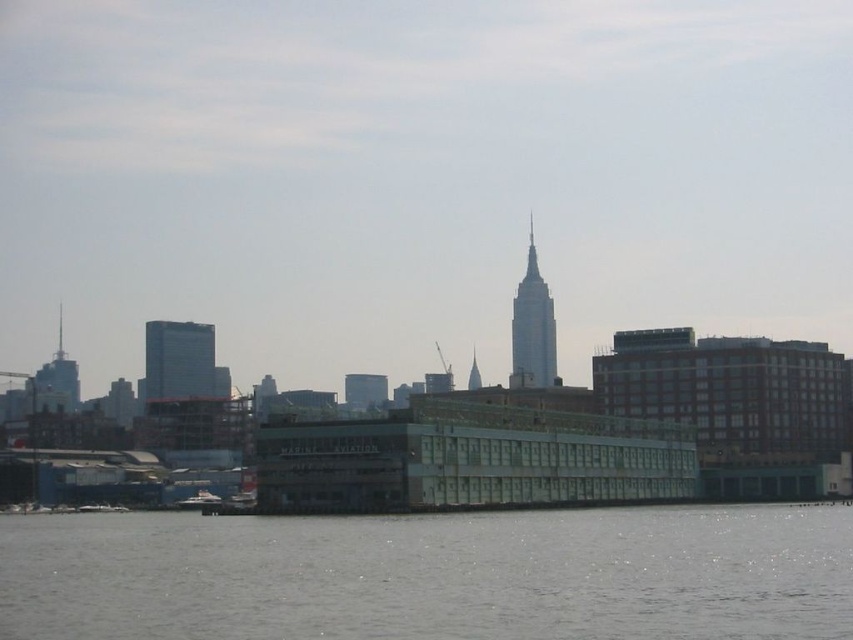
Who is positioned more to the right, silver glass skyscraper at center or white glossy boat at lower left?

silver glass skyscraper at center

Who is shorter, silver glass skyscraper at center or white glossy boat at lower left?

With less height is white glossy boat at lower left.

The height and width of the screenshot is (640, 853). What do you see at coordinates (532, 328) in the screenshot? I see `silver glass skyscraper at center` at bounding box center [532, 328].

The image size is (853, 640). In order to click on silver glass skyscraper at center in this screenshot , I will do `click(532, 328)`.

Does gray water at lower center have a greater width compared to white glossy boat at lower left?

Correct, the width of gray water at lower center exceeds that of white glossy boat at lower left.

Is point (376, 545) behind point (201, 490)?

That is False.

I want to click on gray water at lower center, so click(432, 576).

Who is positioned more to the left, gray water at lower center or glassy reflective skyscraper at left?

Positioned to the left is glassy reflective skyscraper at left.

Does gray water at lower center appear on the left side of glassy reflective skyscraper at left?

Incorrect, gray water at lower center is not on the left side of glassy reflective skyscraper at left.

Does point (708, 563) come closer to viewer compared to point (154, 349)?

Yes, it is.

Locate an element on the screen. gray water at lower center is located at coordinates (432, 576).